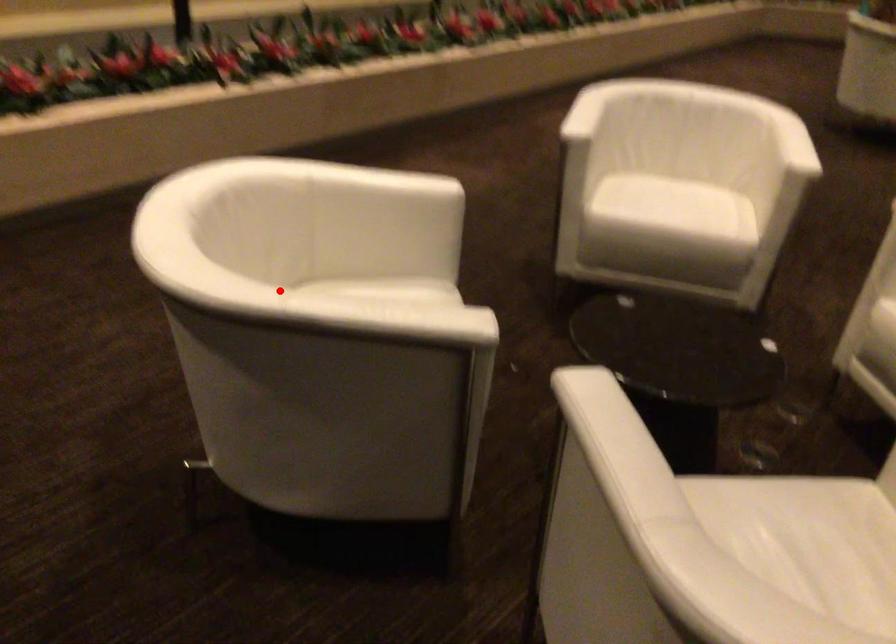
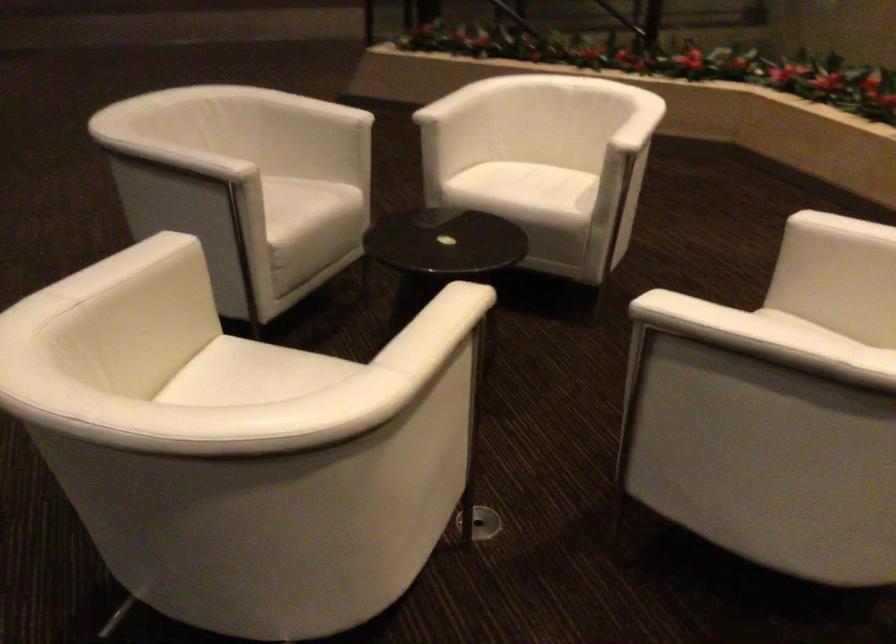
Question: A red point is marked in image1. In image2, is the corresponding 3D point closer to the camera or farther? Reply with the corresponding letter.

Choices:
 (A) The corresponding 3D point is closer.
 (B) The corresponding 3D point is farther.

Answer: (B)